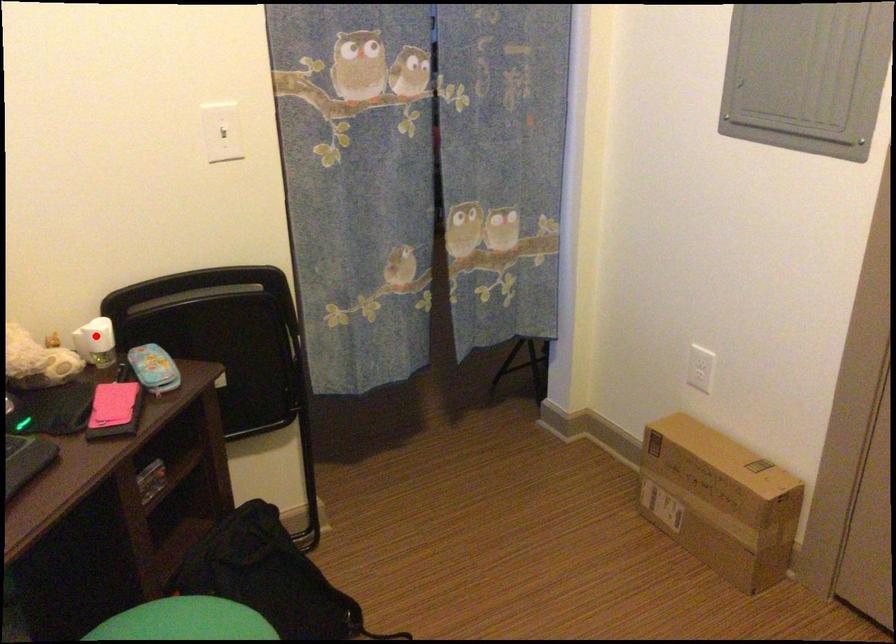
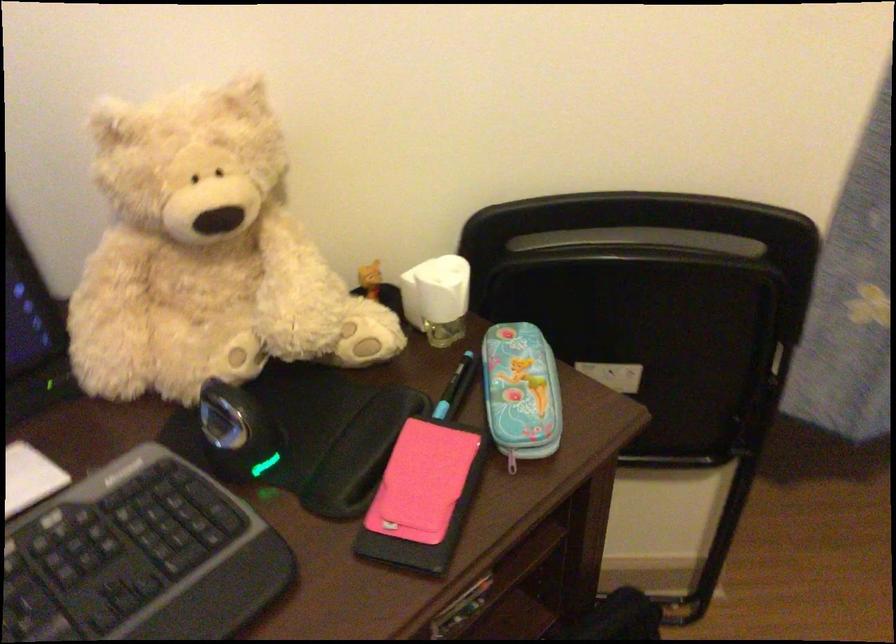
Question: A red point is marked in image1. In image2, is the corresponding 3D point closer to the camera or farther? Reply with the corresponding letter.

Choices:
 (A) The corresponding 3D point is closer.
 (B) The corresponding 3D point is farther.

Answer: (A)